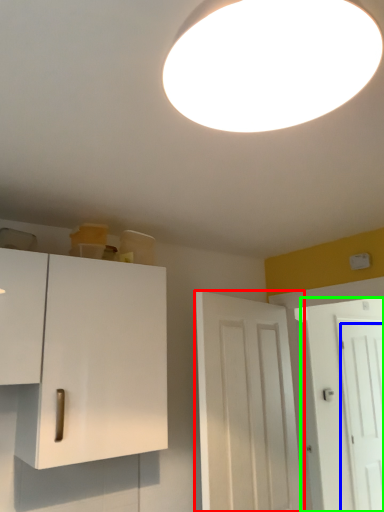
Question: Estimate the real-world distances between objects in this image. Which object is closer to door (highlighted by a red box), door (highlighted by a blue box) or door (highlighted by a green box)?

Choices:
 (A) door
 (B) door

Answer: (B)